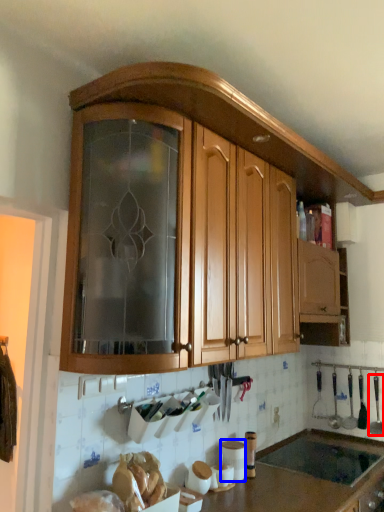
Question: Which object appears farthest to the camera in this image, silverware (highlighted by a red box) or appliance (highlighted by a blue box)?

Choices:
 (A) silverware
 (B) appliance

Answer: (A)